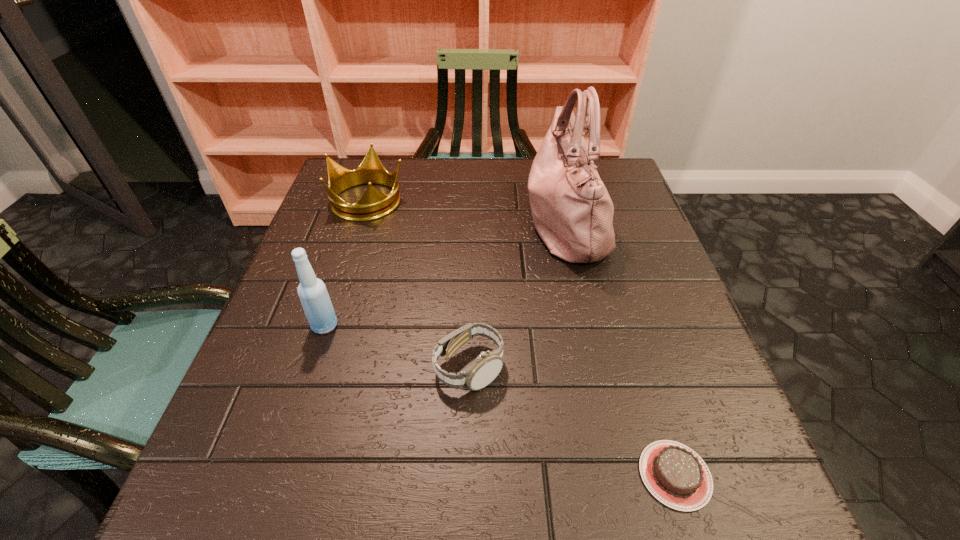
You are a GUI agent. You are given a task and a screenshot of the screen. Output one action in this format:
    pyautogui.click(x=<x>, y=<y>)
    Task: Click on the tallest object
    The image size is (960, 540).
    Given the screenshot: What is the action you would take?
    pyautogui.click(x=572, y=211)

Locate an element on the screen. This screenshot has height=540, width=960. the second tallest object is located at coordinates (315, 300).

The image size is (960, 540). Identify the location of the third farthest object. (315, 300).

I want to click on the third shortest object, so click(373, 204).

Identify the location of the third object from left to right. (481, 372).

Find the location of a particular element. the second nearest object is located at coordinates (481, 372).

What are the coordinates of `chocolate cake` in the screenshot? It's located at (677, 476).

Find the location of `the nearest object`. the nearest object is located at coordinates (677, 476).

What are the coordinates of `vacant space positioned at the front of the tallest object with handles` in the screenshot? It's located at (401, 222).

You are a GUI agent. You are given a task and a screenshot of the screen. Output one action in this format:
    pyautogui.click(x=<x>, y=<y>)
    Task: Click on the vacant region located 0.260m at the front of the tallest object with handles
    This screenshot has width=960, height=540.
    Given the screenshot: What is the action you would take?
    pyautogui.click(x=419, y=222)